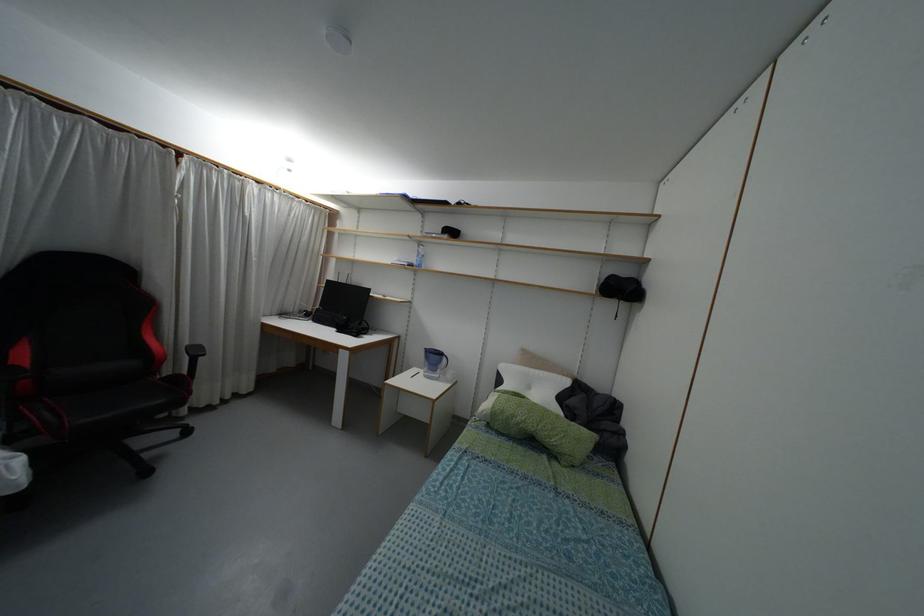
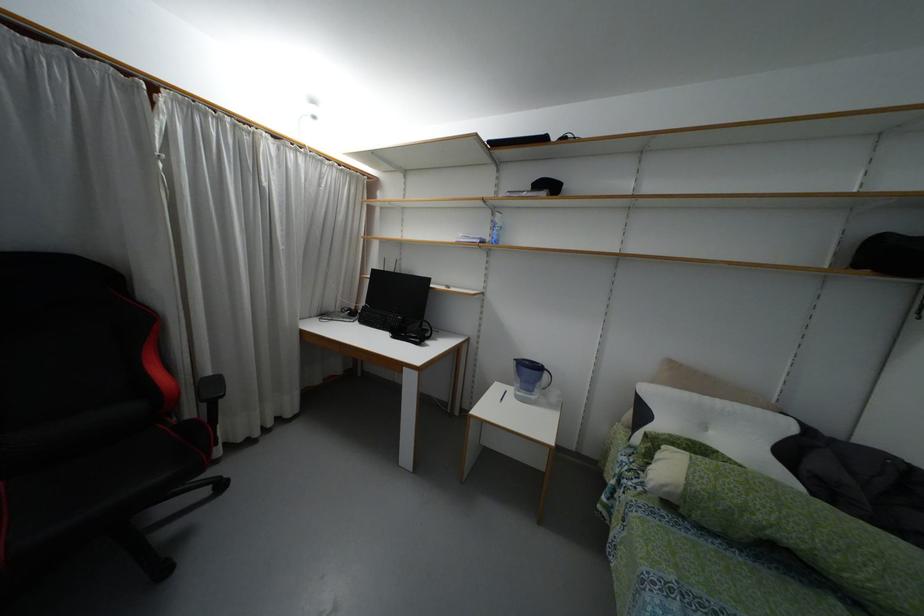
In the second image, find the point that corresponds to (195,352) in the first image.

(213, 387)